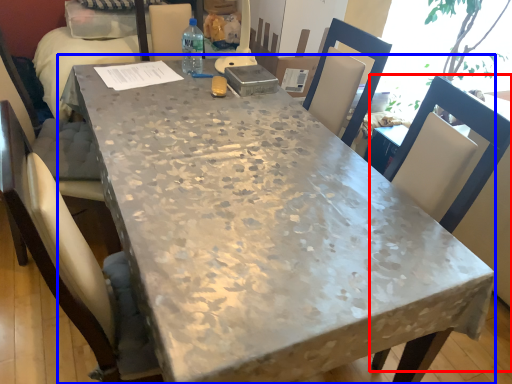
Question: Which object appears closest to the camera in this image, chair (highlighted by a red box) or table (highlighted by a blue box)?

Choices:
 (A) chair
 (B) table

Answer: (B)